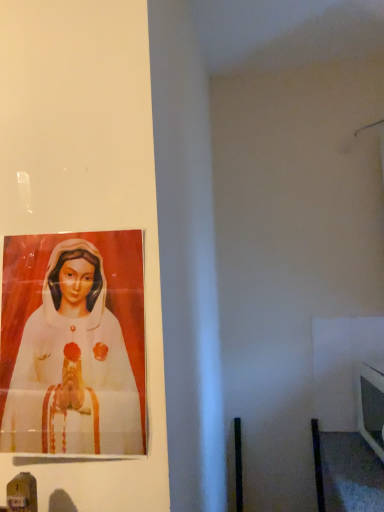
Where is `matte white statue at left`? The image size is (384, 512). matte white statue at left is located at coordinates (67, 362).

This screenshot has width=384, height=512. What do you see at coordinates (67, 362) in the screenshot?
I see `matte white statue at left` at bounding box center [67, 362].

Where is `matte white statue at left`? The image size is (384, 512). matte white statue at left is located at coordinates (67, 362).